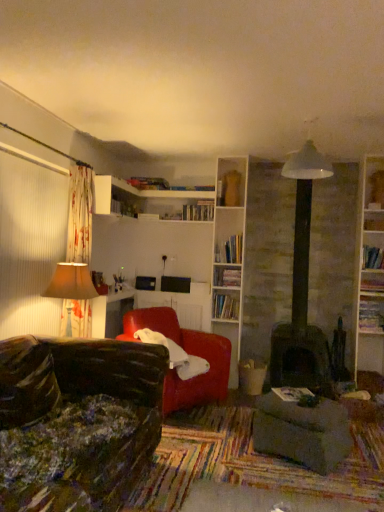
Question: Does matte red armchair at center appear on the left side of hardcover book at center, which is counted as the 5th book, starting from the left?

Choices:
 (A) no
 (B) yes

Answer: (B)

Question: From the image's perspective, does matte red armchair at center appear higher than hardcover book at center, the sixth book from the right?

Choices:
 (A) no
 (B) yes

Answer: (A)

Question: Does matte red armchair at center contain hardcover book at center, the sixth book from the right?

Choices:
 (A) no
 (B) yes

Answer: (A)

Question: Can you confirm if matte red armchair at center is shorter than hardcover book at center, which is counted as the 5th book, starting from the left?

Choices:
 (A) yes
 (B) no

Answer: (B)

Question: Is matte red armchair at center looking in the opposite direction of hardcover book at center, which is the 6th book from bottom to top?

Choices:
 (A) yes
 (B) no

Answer: (B)

Question: Is matte red armchair at center far from hardcover book at center, which is the fifth book from top to bottom?

Choices:
 (A) yes
 (B) no

Answer: (A)

Question: Does hardcover book at center, which is the 6th book from bottom to top, appear on the left side of hardcover book at upper center, positioned as the tenth book in right-to-left order?

Choices:
 (A) no
 (B) yes

Answer: (A)

Question: Does hardcover book at center, the sixth book from the right, come behind hardcover book at upper center, positioned as the tenth book in right-to-left order?

Choices:
 (A) no
 (B) yes

Answer: (B)

Question: From a real-world perspective, is hardcover book at center, which is counted as the 5th book, starting from the left, positioned under hardcover book at upper center, positioned as the tenth book in right-to-left order, based on gravity?

Choices:
 (A) yes
 (B) no

Answer: (A)

Question: Is hardcover book at center, which is counted as the 5th book, starting from the left, not within hardcover book at upper center, the 1th book positioned from the left?

Choices:
 (A) no
 (B) yes

Answer: (B)

Question: Are hardcover book at center, the sixth book from the right, and hardcover book at upper center, which is the ninth book in bottom-to-top order, making contact?

Choices:
 (A) yes
 (B) no

Answer: (B)

Question: From a real-world perspective, is hardcover book at center, which is the 6th book from bottom to top, over hardcover book at upper center, placed as the 2th book when sorted from top to bottom?

Choices:
 (A) no
 (B) yes

Answer: (A)

Question: From a real-world perspective, is hardcover book at upper right, which is counted as the 6th book, starting from the top, over white glossy bookshelf at upper center?

Choices:
 (A) no
 (B) yes

Answer: (A)